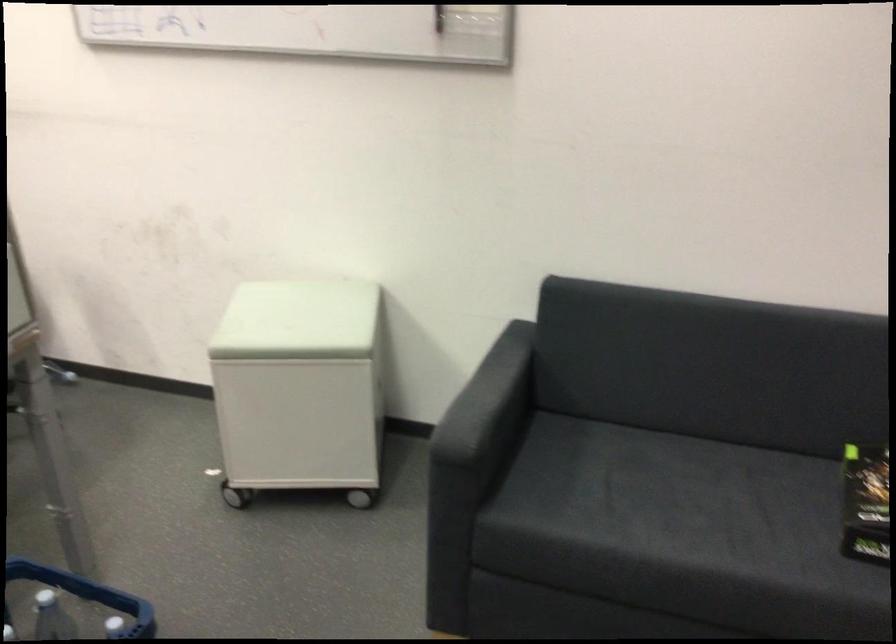
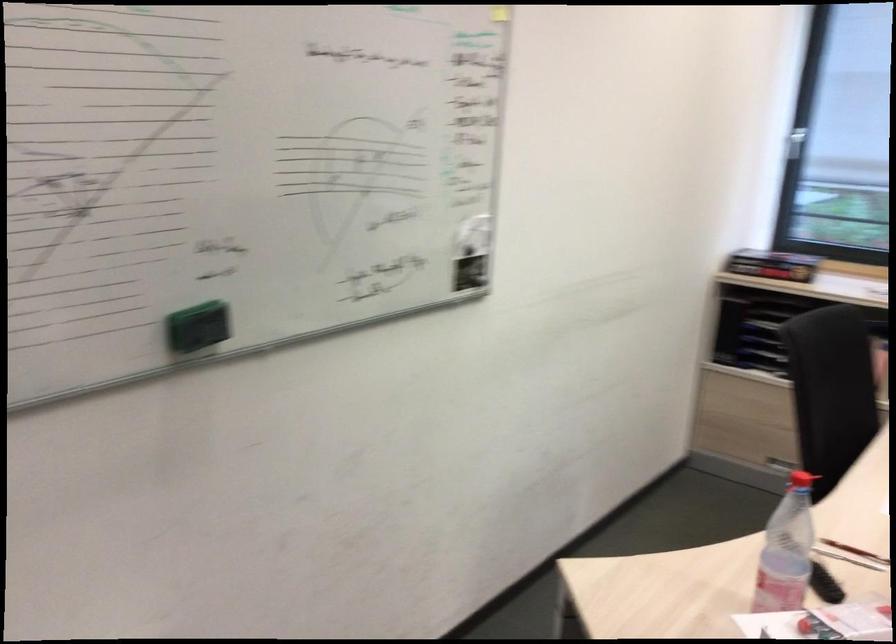
The images are taken continuously from a first-person perspective. In which direction is your viewpoint rotating?

The rotation direction of the camera is left-down.